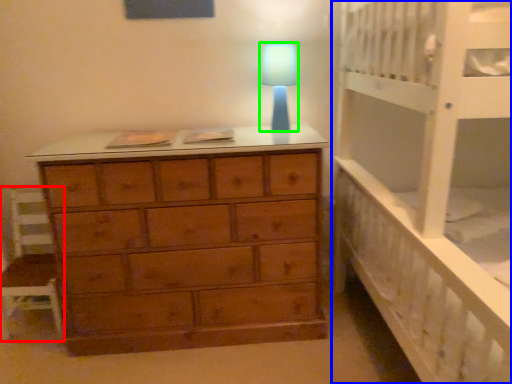
Question: Estimate the real-world distances between objects in this image. Which object is farther from chair (highlighted by a red box), bed (highlighted by a blue box) or lamp (highlighted by a green box)?

Choices:
 (A) bed
 (B) lamp

Answer: (A)